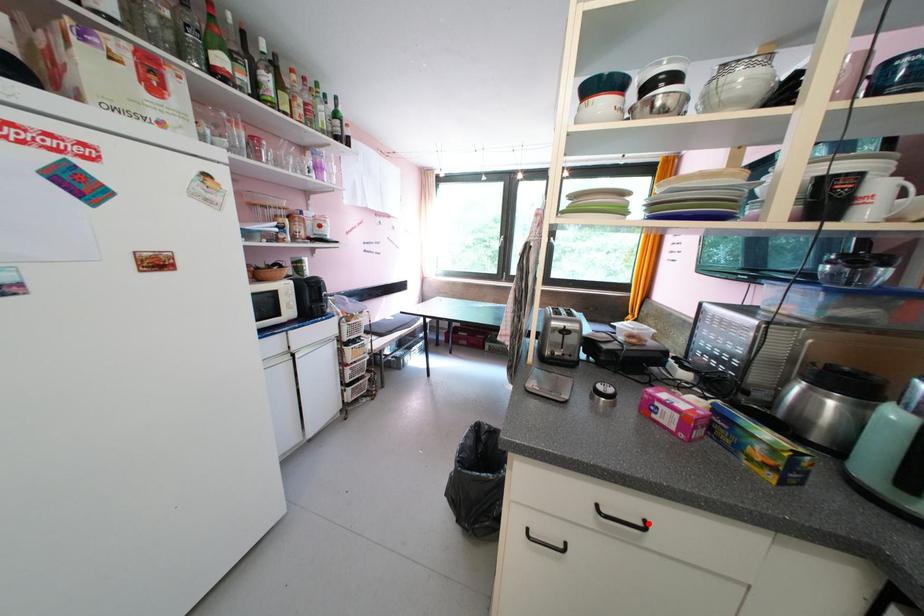
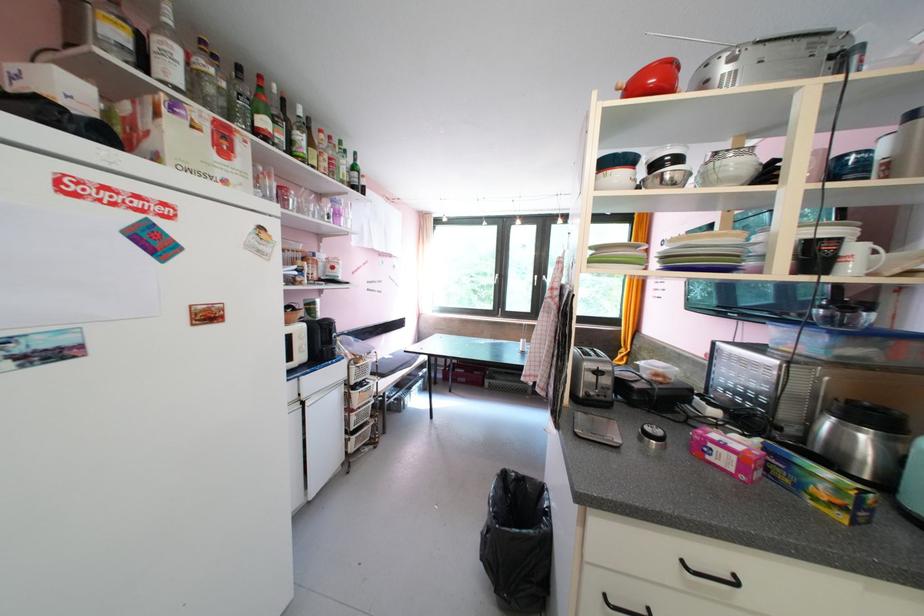
Find the pixel in the second image that matches the highlighted location in the first image.

(736, 578)